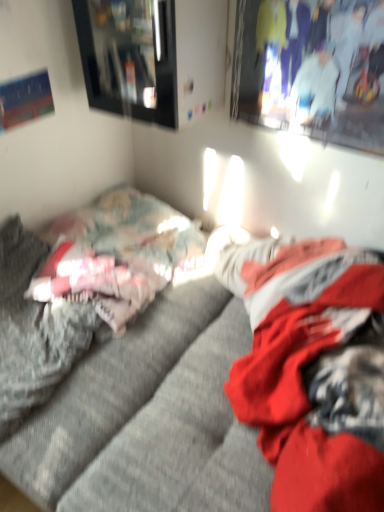
Question: Is matte black picture frame at upper left placed right next to matte white couple at upper right?

Choices:
 (A) no
 (B) yes

Answer: (A)

Question: Are matte black picture frame at upper left and matte white couple at upper right far apart?

Choices:
 (A) no
 (B) yes

Answer: (A)

Question: Is matte white couple at upper right inside matte black picture frame at upper left?

Choices:
 (A) yes
 (B) no

Answer: (B)

Question: Is matte black picture frame at upper left taller than matte white couple at upper right?

Choices:
 (A) no
 (B) yes

Answer: (A)

Question: Is matte black picture frame at upper left smaller than matte white couple at upper right?

Choices:
 (A) yes
 (B) no

Answer: (B)

Question: Is the depth of matte black picture frame at upper left greater than that of matte white couple at upper right?

Choices:
 (A) no
 (B) yes

Answer: (B)

Question: Does matte black picture frame at upper left have a lesser width compared to fluffy gray bed at left?

Choices:
 (A) yes
 (B) no

Answer: (A)

Question: From the image's perspective, does matte black picture frame at upper left appear lower than fluffy gray bed at left?

Choices:
 (A) no
 (B) yes

Answer: (A)

Question: Is fluffy gray bed at left a part of matte black picture frame at upper left?

Choices:
 (A) yes
 (B) no

Answer: (B)

Question: Are matte black picture frame at upper left and fluffy gray bed at left beside each other?

Choices:
 (A) no
 (B) yes

Answer: (A)

Question: Is matte black picture frame at upper left wider than fluffy gray bed at left?

Choices:
 (A) yes
 (B) no

Answer: (B)

Question: Are matte black picture frame at upper left and fluffy gray bed at left far apart?

Choices:
 (A) no
 (B) yes

Answer: (A)

Question: Is there a large distance between textured gray couch at center and matte white couple at upper right?

Choices:
 (A) yes
 (B) no

Answer: (B)